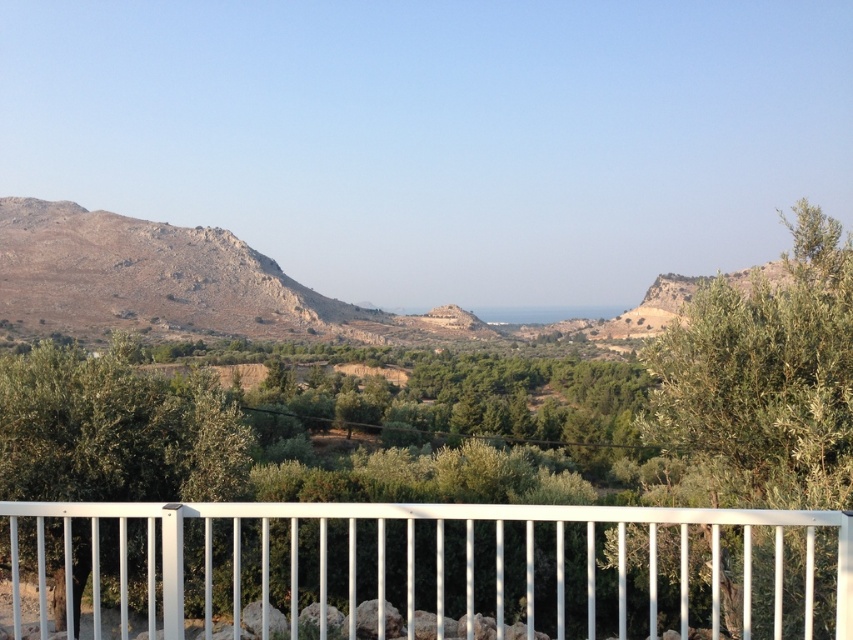
Question: Which point is closer to the camera?

Choices:
 (A) green leafy olive tree at lower left
 (B) white metal railing at lower center

Answer: (B)

Question: Can you confirm if white metal railing at lower center is positioned to the right of green leafy olive tree at lower left?

Choices:
 (A) no
 (B) yes

Answer: (B)

Question: Where is green leafy tree at right located in relation to green leafy olive tree at lower left in the image?

Choices:
 (A) below
 (B) above

Answer: (A)

Question: Estimate the real-world distances between objects in this image. Which object is farther from the brown rocky mountain at center?

Choices:
 (A) green leafy tree at right
 (B) green leafy olive tree at lower left

Answer: (B)

Question: Is white metal railing at lower center below green leafy tree at right?

Choices:
 (A) no
 (B) yes

Answer: (B)

Question: Estimate the real-world distances between objects in this image. Which object is farther from the brown rocky mountain at center?

Choices:
 (A) white metal railing at lower center
 (B) green leafy tree at right
 (C) green leafy olive tree at lower left

Answer: (C)